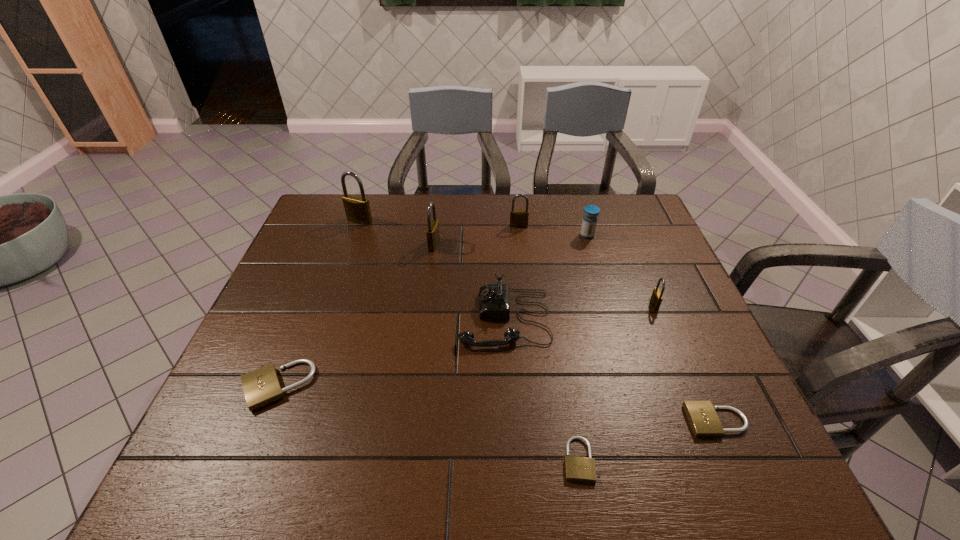
The image size is (960, 540). Find the location of `object located in the far left corner section of the desktop`. object located in the far left corner section of the desktop is located at coordinates (357, 209).

This screenshot has height=540, width=960. I want to click on blank space at the far edge of the desktop, so 509,207.

In the image, there is a desktop. Where is `vacant region at the near edge`? vacant region at the near edge is located at coordinates (470, 475).

Image resolution: width=960 pixels, height=540 pixels. Identify the location of vacant space at the left edge of the desktop. (310, 321).

Locate an element on the screen. vacant area at the right edge of the desktop is located at coordinates (621, 238).

This screenshot has height=540, width=960. Identify the location of free space at the far left corner of the desktop. (348, 225).

Where is `vacant space at the near left corner`? vacant space at the near left corner is located at coordinates (204, 485).

The width and height of the screenshot is (960, 540). In order to click on free region at the far right corner of the desktop in this screenshot , I will do `click(621, 206)`.

Where is `free space at the near right corner of the desktop`? This screenshot has width=960, height=540. free space at the near right corner of the desktop is located at coordinates (767, 477).

The image size is (960, 540). What are the coordinates of `vacant space in between the fifth tallest padlock and the third object from right to left` in the screenshot? It's located at (432, 310).